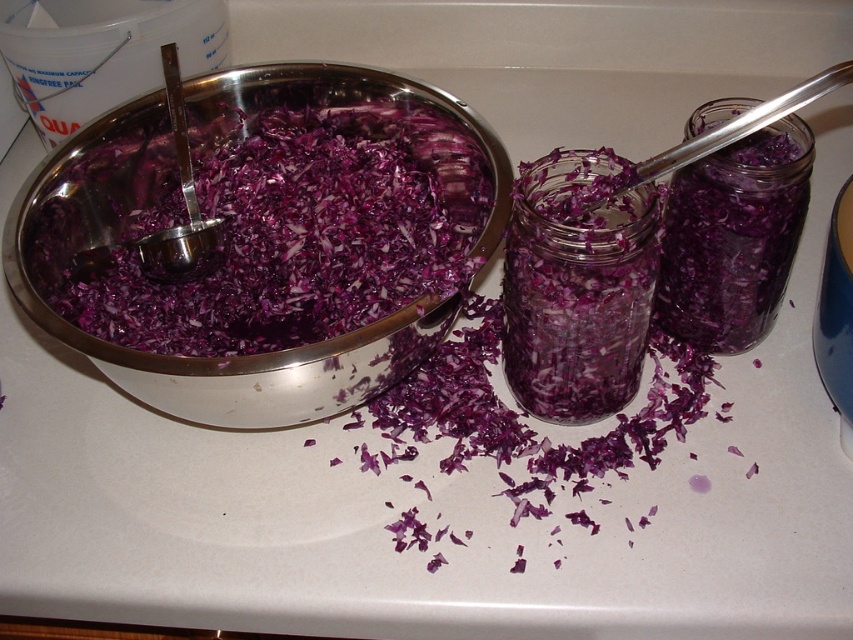
Who is positioned more to the left, translucent glass jar at center or translucent glass jar at right?

translucent glass jar at center

Between translucent glass jar at center and translucent glass jar at right, which one appears on the right side from the viewer's perspective?

Positioned to the right is translucent glass jar at right.

Who is more distant from viewer, (556,275) or (715,225)?

Positioned behind is point (715,225).

The width and height of the screenshot is (853, 640). Identify the location of translucent glass jar at center. (577, 289).

Is point (148, 112) positioned after point (701, 292)?

Yes, it is.

Does shiny metal bowl at center lie behind translucent glass jar at right?

No, it is not.

Find the location of a particular element. shiny metal bowl at center is located at coordinates (227, 356).

Locate an element on the screen. Image resolution: width=853 pixels, height=640 pixels. shiny metal bowl at center is located at coordinates (227, 356).

Between shiny metal bowl at center and translucent glass jar at center, which one is positioned lower?

Positioned lower is translucent glass jar at center.

At what (x,y) coordinates should I click in order to perform the action: click on shiny metal bowl at center. Please return your answer as a coordinate pair (x, y). This screenshot has width=853, height=640. Looking at the image, I should click on (227, 356).